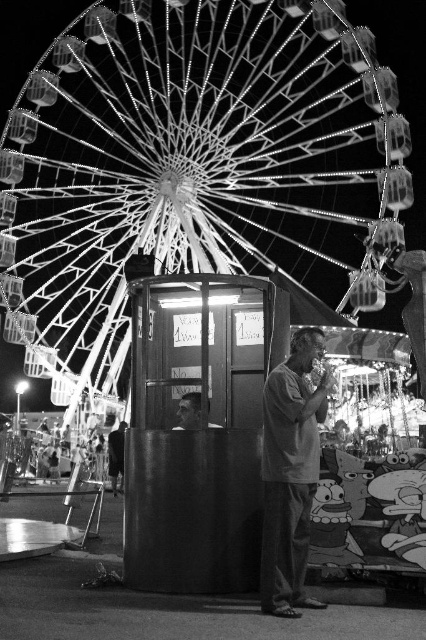
Question: Which point appears farthest from the camera in this image?

Choices:
 (A) (181, 412)
 (B) (120, 449)
 (C) (178, 212)

Answer: (C)

Question: Does metallic ferris wheel at upper center have a larger size compared to smooth skin face at center?

Choices:
 (A) no
 (B) yes

Answer: (B)

Question: Based on their relative distances, which object is nearer to the matte gray shirt at center?

Choices:
 (A) smooth black shirt at center
 (B) metallic ferris wheel at upper center

Answer: (A)

Question: Which of the following is the closest to the observer?

Choices:
 (A) metallic ferris wheel at upper center
 (B) smooth black shirt at center
 (C) matte gray shirt at center
 (D) smooth skin face at center

Answer: (C)

Question: Is metallic ferris wheel at upper center below matte gray shirt at center?

Choices:
 (A) yes
 (B) no

Answer: (B)

Question: Does smooth black shirt at center appear over smooth skin face at center?

Choices:
 (A) no
 (B) yes

Answer: (A)